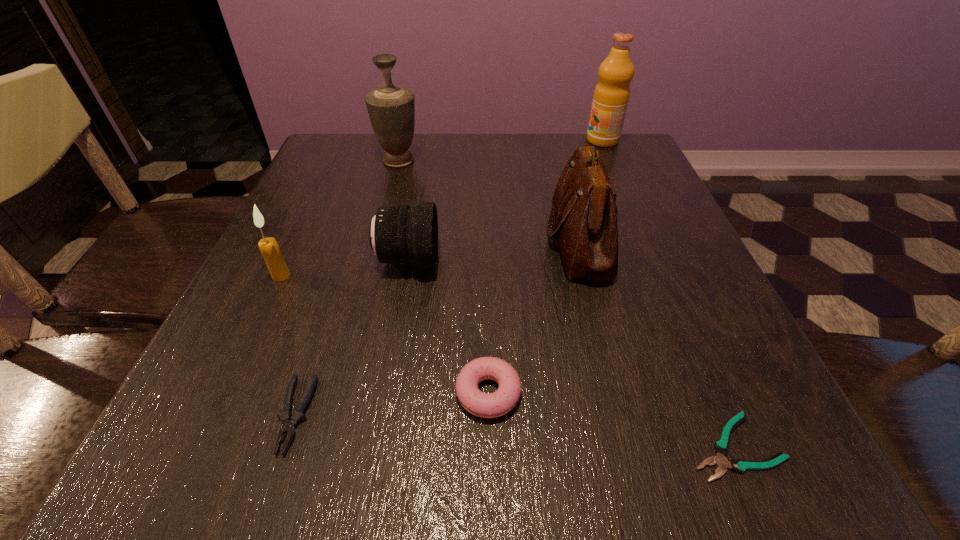
Locate an element on the screen. The image size is (960, 540). pliers that is at the right edge is located at coordinates (721, 447).

Where is `object that is positioned at the far left corner`? object that is positioned at the far left corner is located at coordinates (391, 109).

This screenshot has width=960, height=540. In order to click on object that is at the near left corner in this screenshot , I will do `click(289, 421)`.

Identify the location of object present at the far right corner. Image resolution: width=960 pixels, height=540 pixels. (611, 95).

Find the location of a particular element. This screenshot has height=540, width=960. object at the near right corner is located at coordinates (721, 447).

In the image, there is a desktop. At what (x,y) coordinates should I click in order to perform the action: click on vacant space at the far edge. Please return your answer as a coordinate pair (x, y). The image size is (960, 540). Looking at the image, I should click on (458, 143).

Locate an element on the screen. The image size is (960, 540). free space at the near edge of the desktop is located at coordinates (426, 455).

Where is `vacant space at the left edge of the desktop`? vacant space at the left edge of the desktop is located at coordinates (313, 306).

You are a GUI agent. You are given a task and a screenshot of the screen. Output one action in this format:
    pyautogui.click(x=<x>, y=<y>)
    Task: Click on the free space at the right edge of the desktop
    
    Given the screenshot: What is the action you would take?
    pyautogui.click(x=635, y=215)

You are a GUI agent. You are given a task and a screenshot of the screen. Output one action in this format:
    pyautogui.click(x=<x>, y=<y>)
    Task: Click on the vacant region at the near left corner
    The image size is (960, 540).
    Given the screenshot: What is the action you would take?
    pyautogui.click(x=165, y=455)